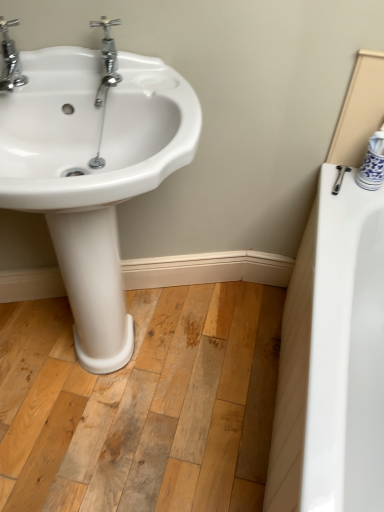
What are the coordinates of `spots to the right of chrome metallic faucet at upper left, the second tap when ordered from right to left` in the screenshot? It's located at (84, 79).